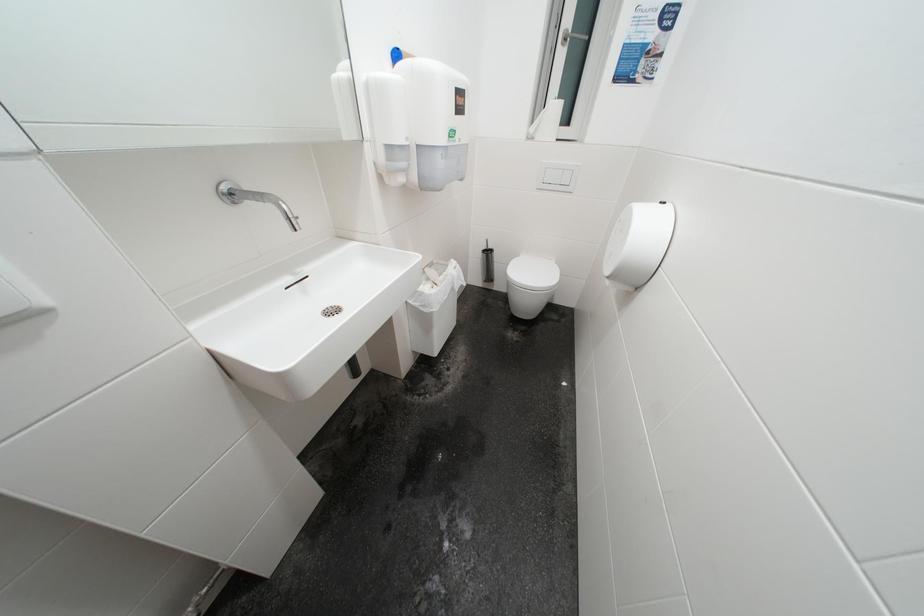
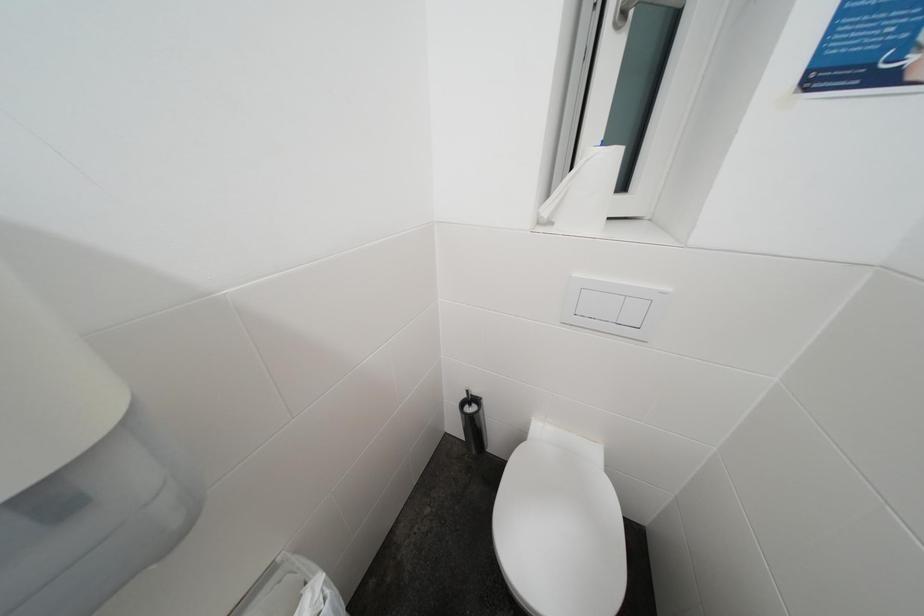
Question: In a continuous first-person perspective shot, in which direction is the camera moving?

Choices:
 (A) Left
 (B) Right
 (C) Forward
 (D) Backward

Answer: (C)